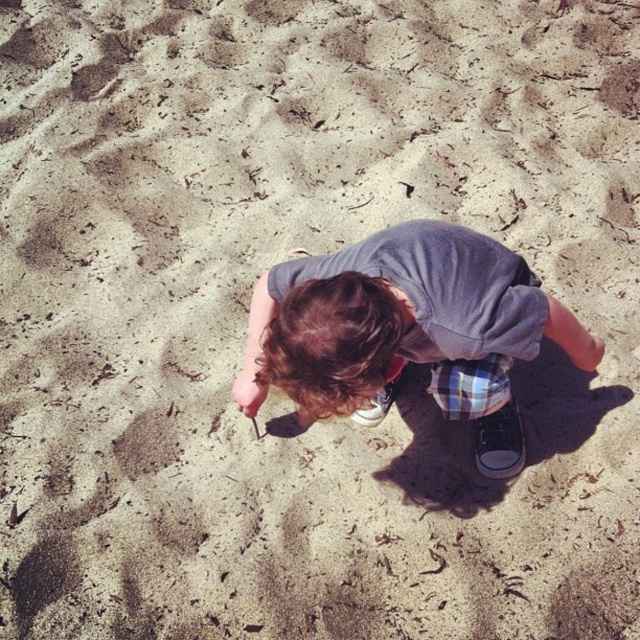
You are a photographer taking a picture of the gray cotton shirt at center and the matte gray shoe at center. Which object will appear larger in the photo?

The gray cotton shirt at center appears larger in the photo because it is positioned over the matte gray shoe at center, making it closer to the camera.

You are a photographer taking a picture of the gray cotton shirt at center and the black canvas shoe at lower right. Which object should you zoom in on to ensure both are in frame without moving the camera?

You should zoom in on the gray cotton shirt at center because its width is greater than the black canvas shoe at lower right, so focusing on it will ensure both fit within the frame.

In the scene shown: You are a photographer trying to capture the child in the image. To ensure both the gray cotton shirt at center and the black canvas shoe at lower right are visible in the frame, should you position yourself to the left or right side of the child?

You should position yourself to the right side of the child because the gray cotton shirt at center is to the left of the black canvas shoe at lower right, so positioning yourself to the right will keep both objects within the frame.